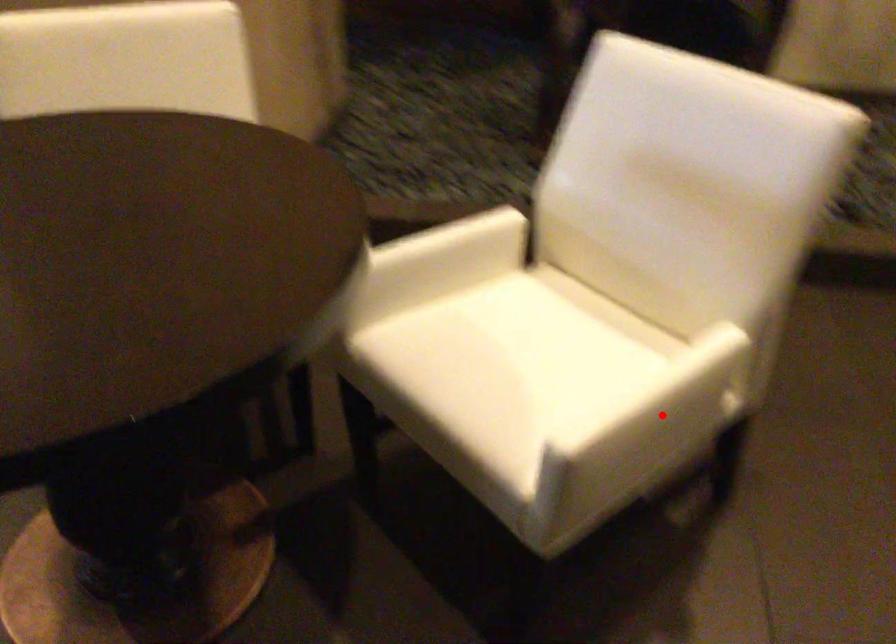
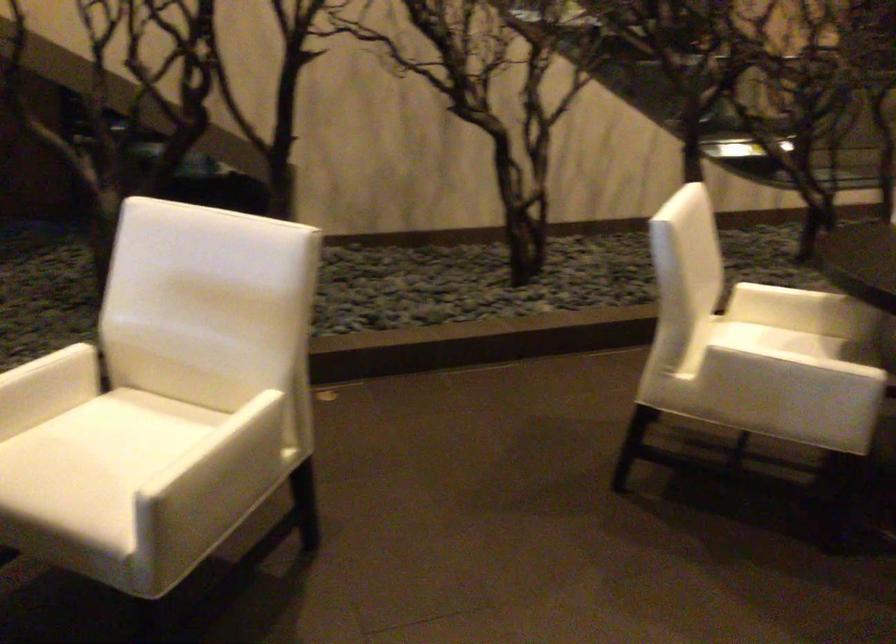
Question: I am providing you with two images of the same scene from different viewpoints. A red point is marked on the first image. Can you still see the location of the red point in image 2?

Choices:
 (A) Yes
 (B) No

Answer: (A)